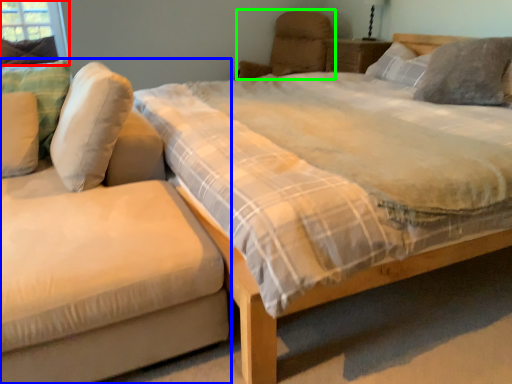
Question: Which is farther away from window screen (highlighted by a red box)? studio couch (highlighted by a blue box) or armchair (highlighted by a green box)?

Choices:
 (A) studio couch
 (B) armchair

Answer: (A)